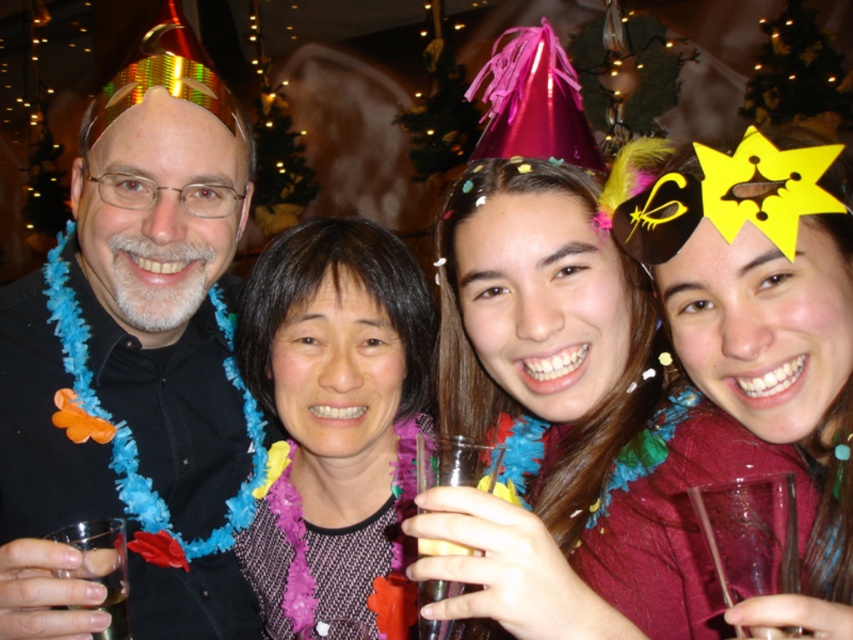
In the scene shown: Is shiny maroon dress at center positioned at the back of transparent plastic wine glass at lower right?

No, shiny maroon dress at center is closer to the viewer.

Locate an element on the screen. shiny maroon dress at center is located at coordinates (764, 324).

The image size is (853, 640). In order to click on shiny maroon dress at center in this screenshot , I will do `click(764, 324)`.

Who is taller, shiny maroon dress at center or black fabric at center?

black fabric at center

Does shiny maroon dress at center appear on the right side of black fabric at center?

Correct, you'll find shiny maroon dress at center to the right of black fabric at center.

This screenshot has height=640, width=853. What are the coordinates of `shiny maroon dress at center` in the screenshot? It's located at (764, 324).

Locate an element on the screen. Image resolution: width=853 pixels, height=640 pixels. black fabric at center is located at coordinates (335, 419).

Is black fabric at center shorter than translucent plastic cup at lower center?

No, black fabric at center is not shorter than translucent plastic cup at lower center.

Which is behind, point (415, 330) or point (416, 440)?

The point (415, 330) is more distant.

This screenshot has width=853, height=640. I want to click on black fabric at center, so click(x=335, y=419).